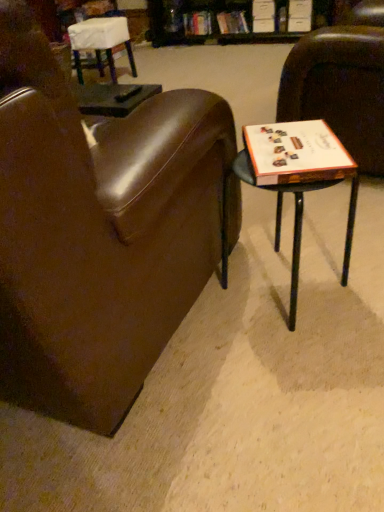
What are the coordinates of `vacant area that lies in front of wooden table at right` in the screenshot? It's located at (294, 382).